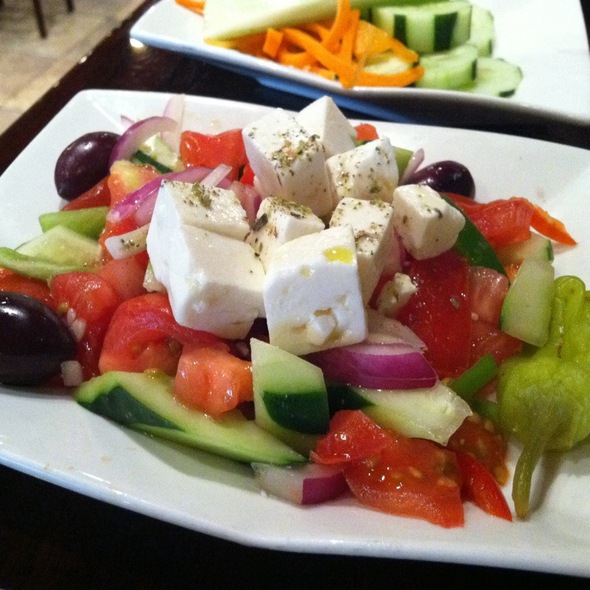
The height and width of the screenshot is (590, 590). In order to click on wooden table in this screenshot , I will do `click(194, 80)`.